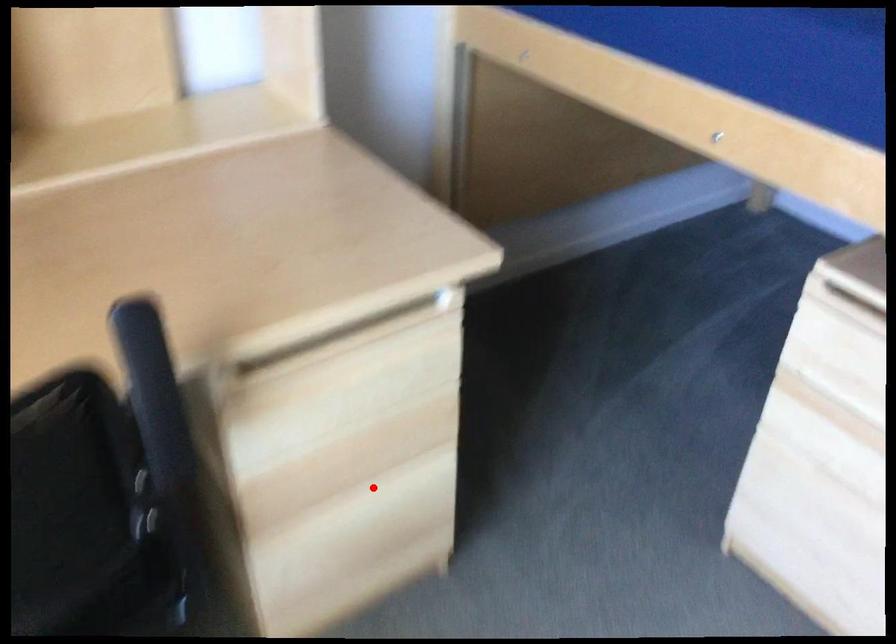
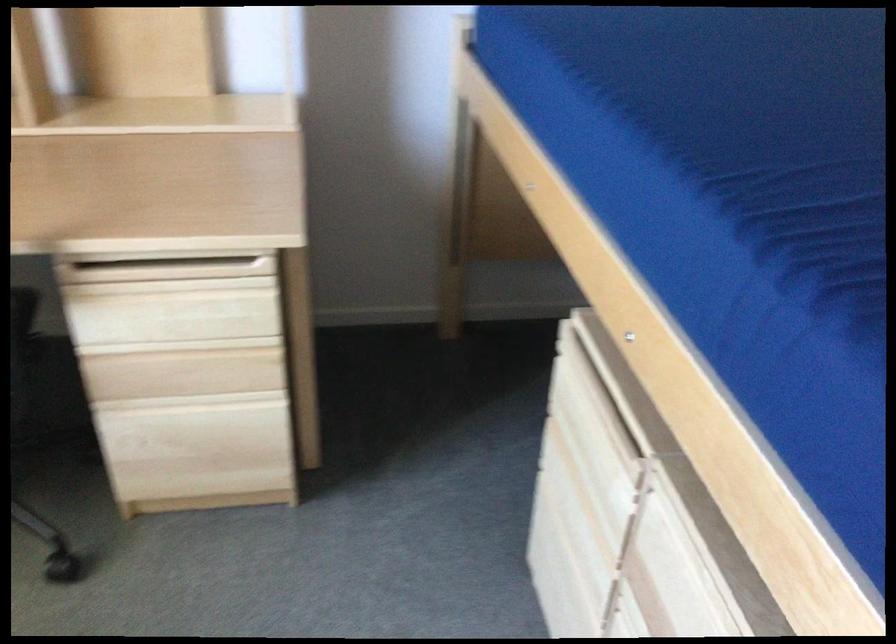
Question: I am providing you with two images of the same scene from different viewpoints. A red point is marked on the first image. Is the red point's position out of view in image 2?

Choices:
 (A) Yes
 (B) No

Answer: (B)